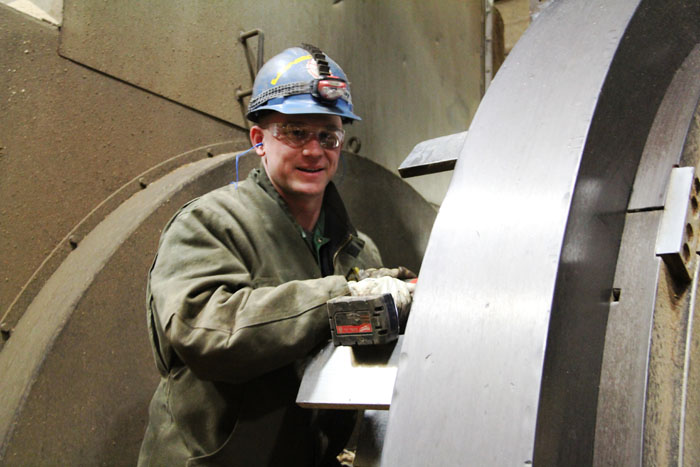
I want to click on wall, so click(x=108, y=158).